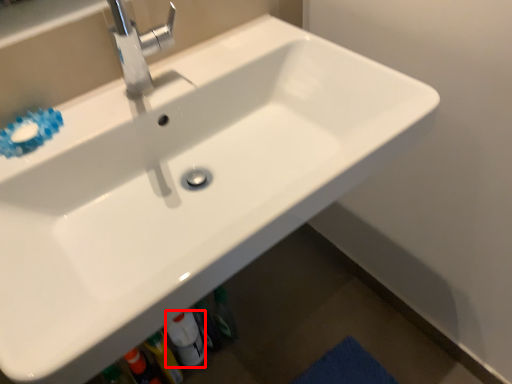
Question: Observing the image, what is the correct spatial positioning of bottle (annotated by the red box) in reference to tap?

Choices:
 (A) left
 (B) right

Answer: (B)